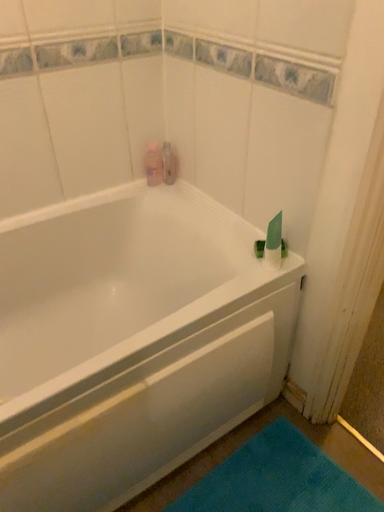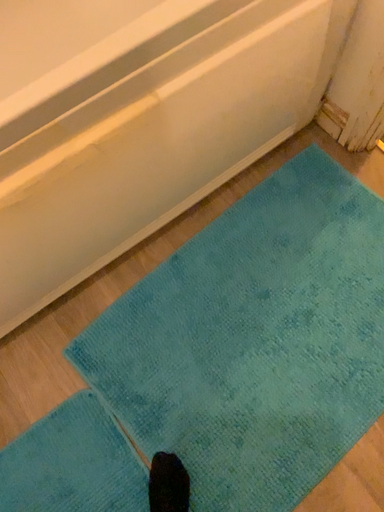
Question: Which way did the camera rotate in the video?

Choices:
 (A) rotated downward
 (B) rotated upward

Answer: (A)